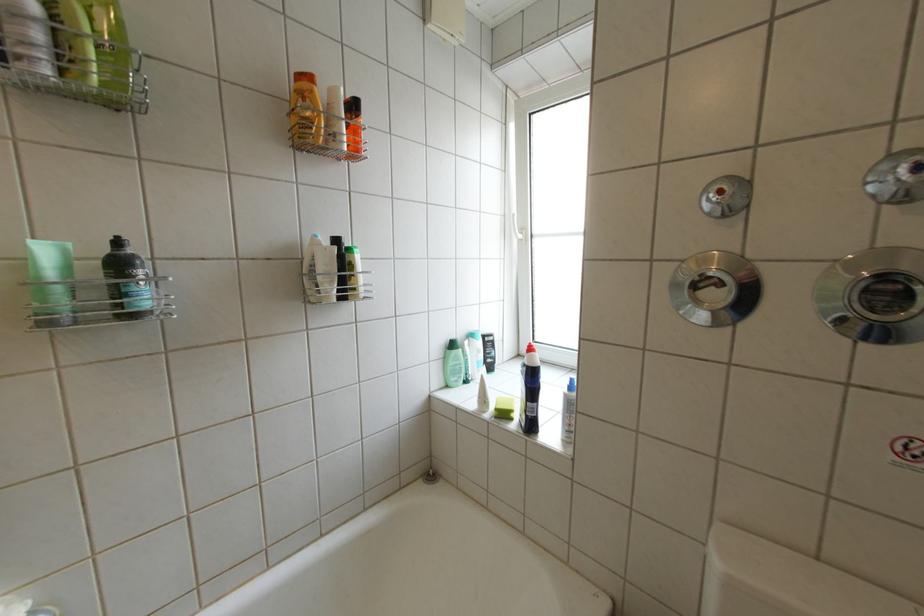
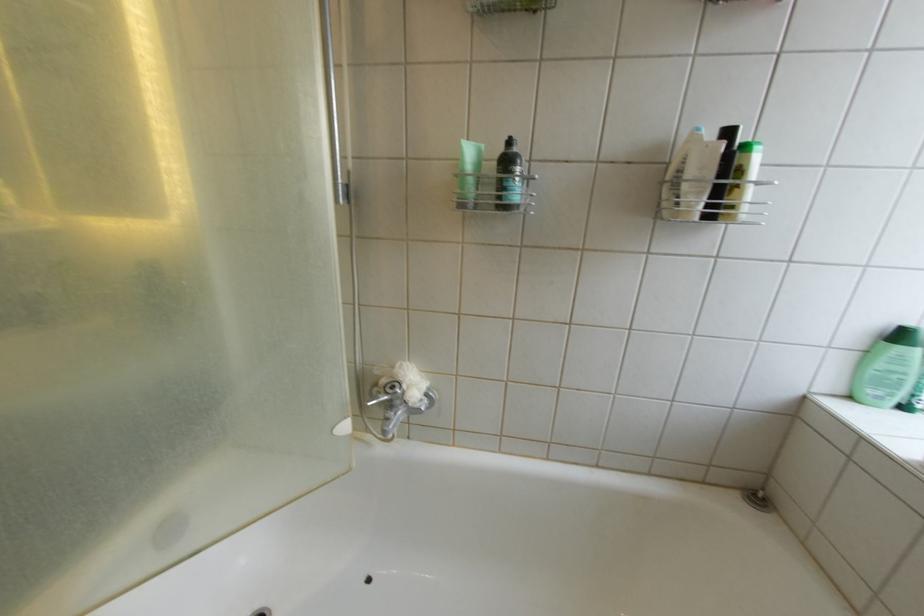
Question: Based on the continuous images, in which direction is the camera rotating? Reply with the corresponding letter.

Choices:
 (A) Left
 (B) Right
 (C) Up
 (D) Down

Answer: (A)